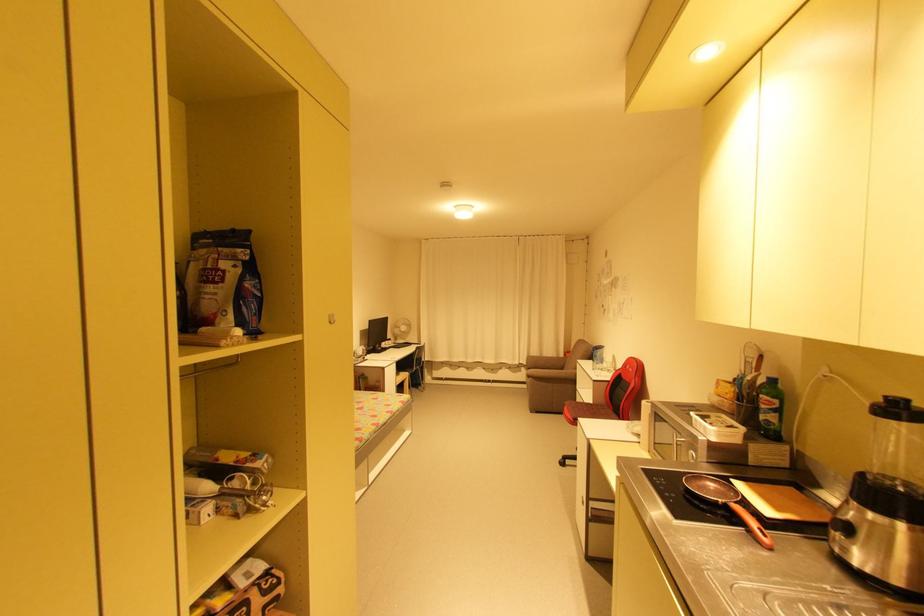
Find where to sit the red chair sitting surface. Please return your answer as a coordinate pair (x, y).

(609, 399)